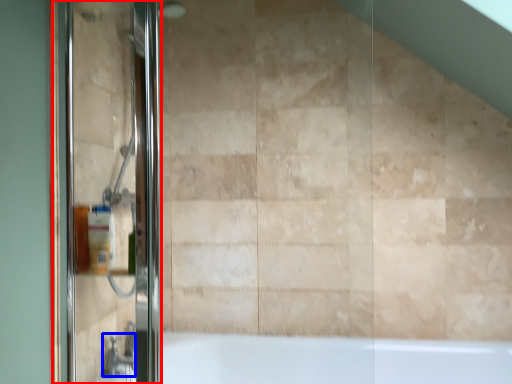
Question: Among these objects, which one is nearest to the camera, screen door (highlighted by a red box) or faucet (highlighted by a blue box)?

Choices:
 (A) screen door
 (B) faucet

Answer: (A)